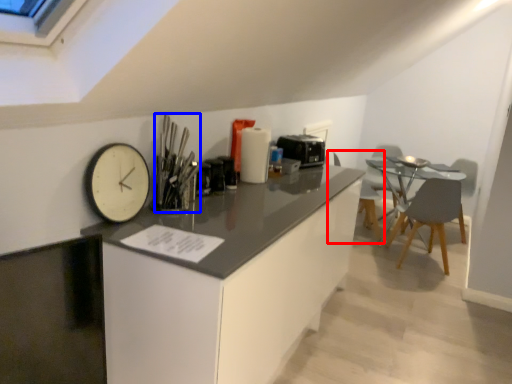
Question: Which point is closer to the camera, chair (highlighted by a red box) or silverware (highlighted by a blue box)?

Choices:
 (A) chair
 (B) silverware

Answer: (B)